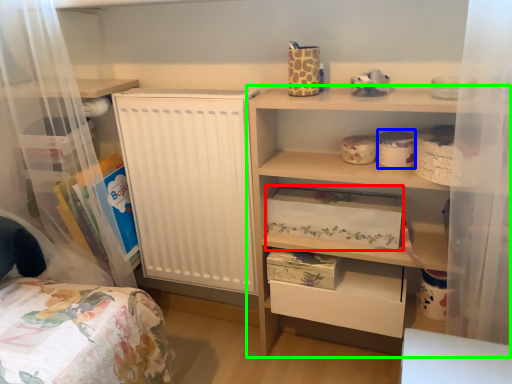
Question: Which is nearer to the storage box (highlighted by a red box)? storage box (highlighted by a blue box) or shelf (highlighted by a green box).

Choices:
 (A) storage box
 (B) shelf

Answer: (B)